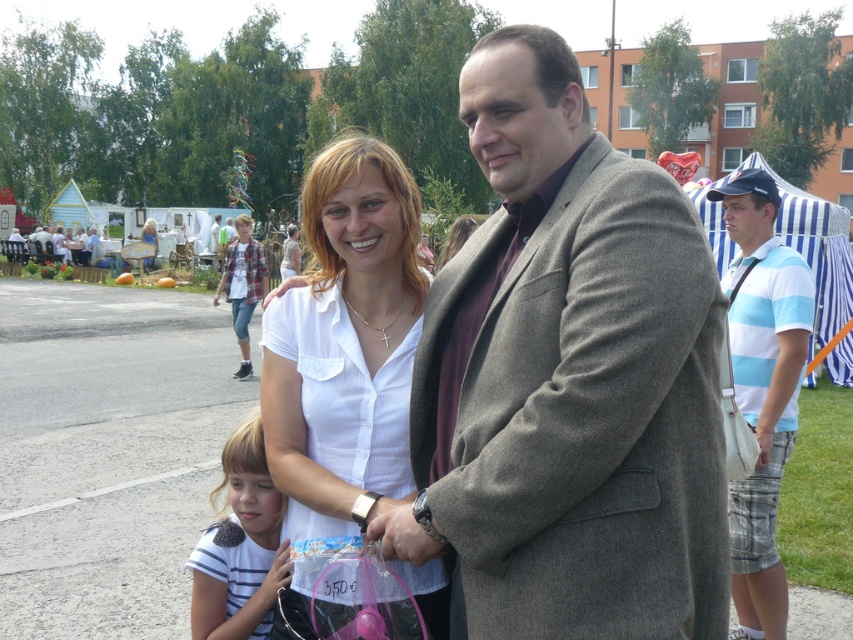
Question: Is white smooth shirt at center to the left of white glossy shirt at center from the viewer's perspective?

Choices:
 (A) no
 (B) yes

Answer: (A)

Question: Which of these objects is positioned farthest from the blue striped shirt at right?

Choices:
 (A) matte brown coat at center
 (B) white glossy shirt at center
 (C) white striped shirt at center

Answer: (B)

Question: Estimate the real-world distances between objects in this image. Which object is closer to the white smooth shirt at center?

Choices:
 (A) white striped shirt at center
 (B) white glossy shirt at center

Answer: (A)

Question: Is white smooth shirt at center further to camera compared to blue striped shirt at right?

Choices:
 (A) no
 (B) yes

Answer: (A)

Question: Which of these objects is positioned closest to the matte brown coat at center?

Choices:
 (A) white glossy shirt at center
 (B) blue striped shirt at right
 (C) white smooth shirt at center
 (D) white striped shirt at center

Answer: (C)

Question: In this image, where is white smooth shirt at center located relative to white glossy shirt at center?

Choices:
 (A) below
 (B) above

Answer: (A)